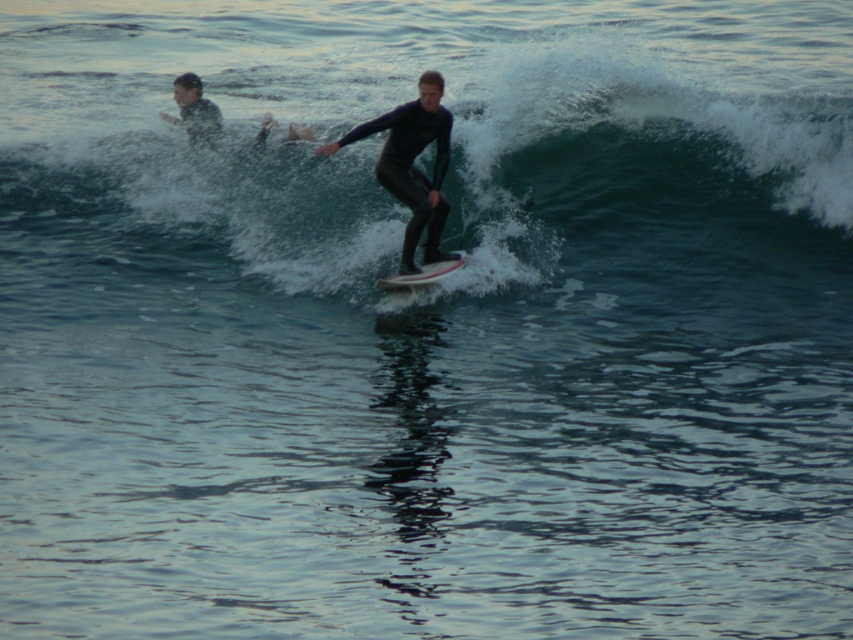
Question: Which of the following is the closest to the observer?

Choices:
 (A) black matte surfboard at center
 (B) green rubber wave at upper center

Answer: (A)

Question: Is green rubber wave at upper center wider than dark blue wetsuit surfer at upper left?

Choices:
 (A) no
 (B) yes

Answer: (B)

Question: Which point is farther to the camera?

Choices:
 (A) (428, 268)
 (B) (207, 131)
 (C) (422, 188)
 (D) (210, 228)

Answer: (B)

Question: Does dark blue wetsuit surfer at upper left have a smaller size compared to white foam surfboard at center?

Choices:
 (A) no
 (B) yes

Answer: (A)

Question: Which point is farther from the camera taking this photo?

Choices:
 (A) (827, 301)
 (B) (219, 120)
 (C) (393, 285)

Answer: (B)

Question: Is dark blue wetsuit surfer at upper left wider than white foam surfboard at center?

Choices:
 (A) no
 (B) yes

Answer: (A)